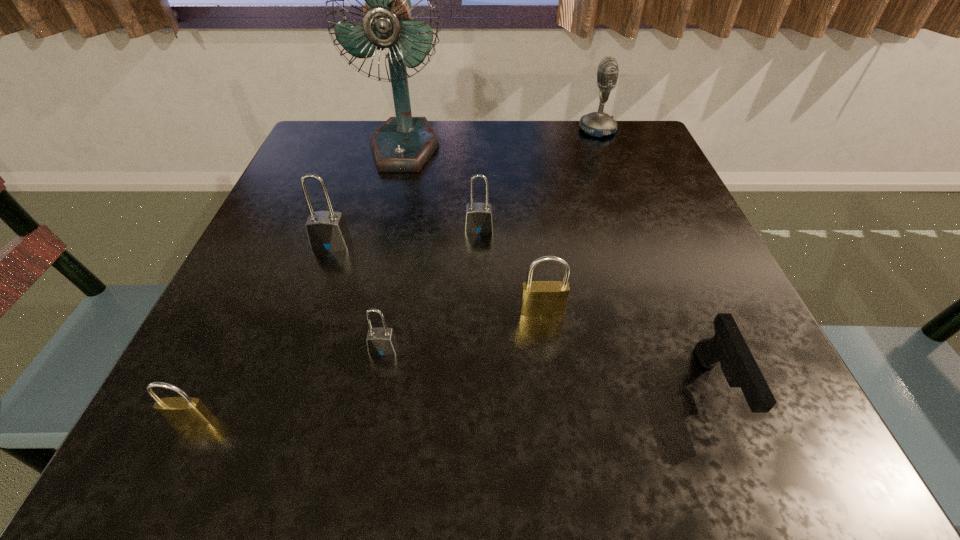
Select which object appears as the fourth closest to the pistol. Please provide its 2D coordinates. Your answer should be formatted as a tuple, i.e. [(x, y)], where the tuple contains the x and y coordinates of a point satisfying the conditions above.

[(327, 230)]

The height and width of the screenshot is (540, 960). Find the location of `the closest padlock relative to the third nearest padlock`. the closest padlock relative to the third nearest padlock is located at coordinates (479, 220).

Identify which padlock is the second nearest to the farther brass padlock. Please provide its 2D coordinates. Your answer should be formatted as a tuple, i.e. [(x, y)], where the tuple contains the x and y coordinates of a point satisfying the conditions above.

[(381, 341)]

Where is `the closest gray padlock to the microphone`? the closest gray padlock to the microphone is located at coordinates (479, 220).

Identify the location of gray padlock that is the third closest to the blue fan. Image resolution: width=960 pixels, height=540 pixels. (381, 341).

Identify the location of vacant space that satisfies the following two spatial constraints: 1. on the front-facing side of the microphone; 2. on the shackle of the third padlock from right to left. [680, 348].

At what (x,y) coordinates should I click in order to perform the action: click on vacant area in the image that satisfies the following two spatial constraints: 1. on the front-facing side of the microphone; 2. in front of the tallest object where the wind blows. Please return your answer as a coordinate pair (x, y). The image size is (960, 540). Looking at the image, I should click on (604, 147).